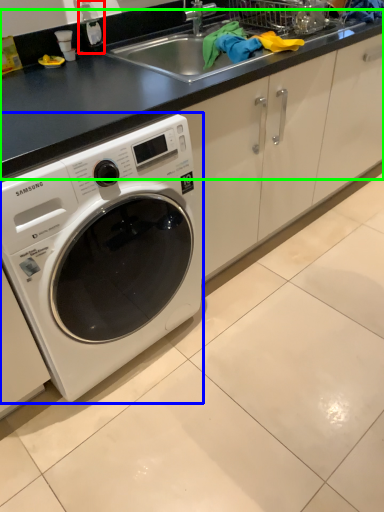
Question: Which object is the closest to the bottle (highlighted by a red box)? Choose among these: washing machine (highlighted by a blue box) or counter top (highlighted by a green box).

Choices:
 (A) washing machine
 (B) counter top

Answer: (B)